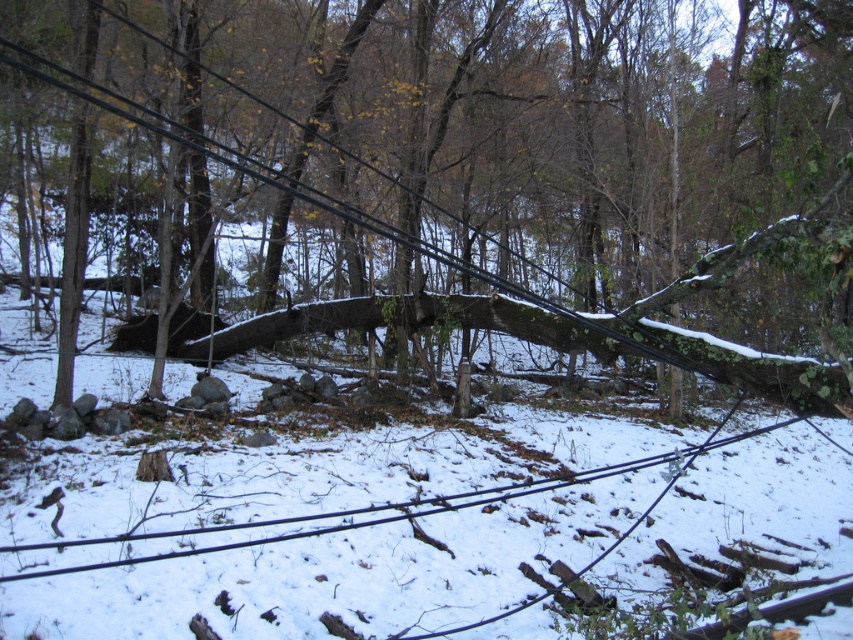
Consider the image. You are a utility worker assessing damage after a storm. You see the brown rough tree trunk at center and the black wire at lower center. How far apart are these two objects in meters?

The brown rough tree trunk at center and the black wire at lower center are 6.57 meters apart.

You are a wildlife photographer standing in the snowy forest scene. You want to capture a closeup shot of the brown rough tree trunk at center. Given that your camera lens has a minimum focusing distance of 2 meters, will you be able to take the photo without moving closer?

The brown rough tree trunk at center is 1.97 meters from viewer, which is closer than the camera lens minimum focusing distance of 2 meters. Therefore, you cannot take the photo without moving further back.

You are a utility worker assessing damage after a storm. You see the brown rough tree trunk at center and the black wire at lower center. Which object is wider in terms of width?

The brown rough tree trunk at center is wider than the black wire at lower center according to the description.